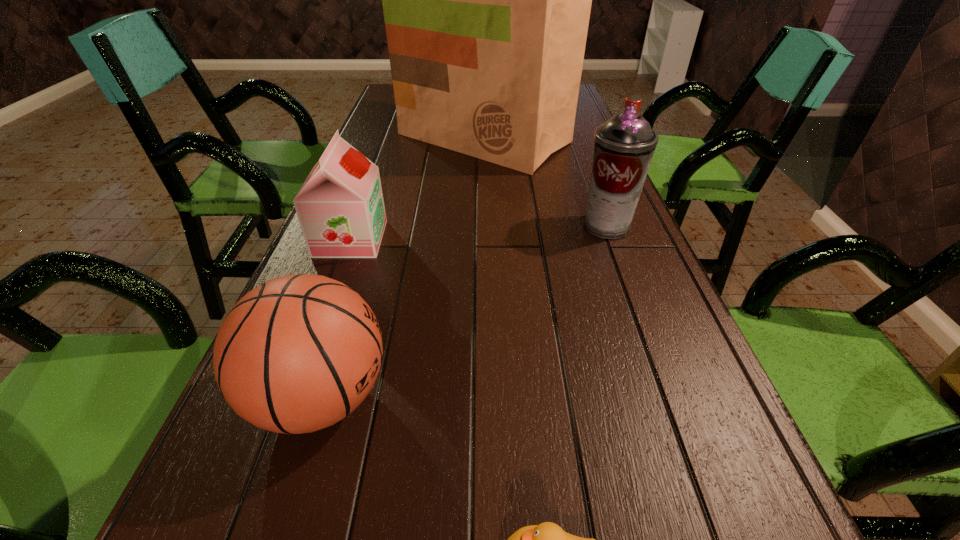
The width and height of the screenshot is (960, 540). I want to click on soya milk that is at the left edge, so click(340, 207).

The image size is (960, 540). What are the coordinates of `basketball present at the left edge` in the screenshot? It's located at pos(298,353).

Image resolution: width=960 pixels, height=540 pixels. I want to click on grocery bag positioned at the right edge, so click(x=486, y=0).

Locate an element on the screen. The height and width of the screenshot is (540, 960). aerosol can at the right edge is located at coordinates (624, 145).

Locate an element on the screen. The image size is (960, 540). free location at the left edge of the desktop is located at coordinates (382, 145).

This screenshot has height=540, width=960. I want to click on vacant region at the right edge, so click(566, 164).

What are the coordinates of `vacant point located between the second tallest object and the basketball` in the screenshot? It's located at (464, 312).

Find the location of a particular element. This screenshot has height=540, width=960. free space between the soya milk and the aerosol can is located at coordinates (478, 232).

Find the location of a particular element. The width and height of the screenshot is (960, 540). vacant area that lies between the tallest object and the basketball is located at coordinates (402, 268).

Identify the location of free area in between the aerosol can and the soya milk. The image size is (960, 540). (478, 232).